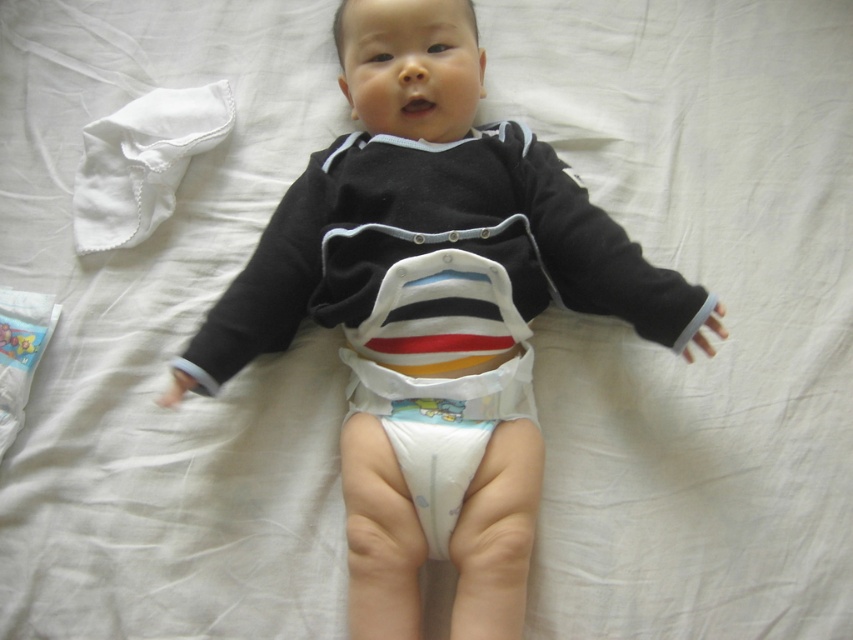
You are a parent trying to change your baby. The soft cotton baby at center is lying on a white fabric surface. You need to reach the white paper diaper at center to proceed. Can you comfortably reach the diaper without moving the baby?

The soft cotton baby at center and white paper diaper at center are 11.76 centimeters apart from each other. Since the distance is relatively short, you can comfortably reach the white paper diaper at center without moving the baby.

You are a parent trying to dress your baby. You have a soft cotton baby at center and a white paper diaper at center. Which item is taller?

The soft cotton baby at center is taller than the white paper diaper at center.